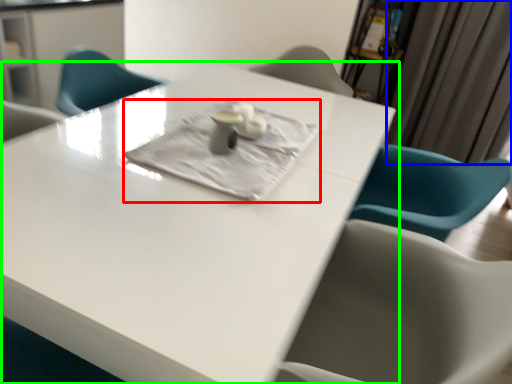
Question: Which object is the farthest from cloth (highlighted by a red box)? Choose among these: curtain (highlighted by a blue box) or table (highlighted by a green box).

Choices:
 (A) curtain
 (B) table

Answer: (A)